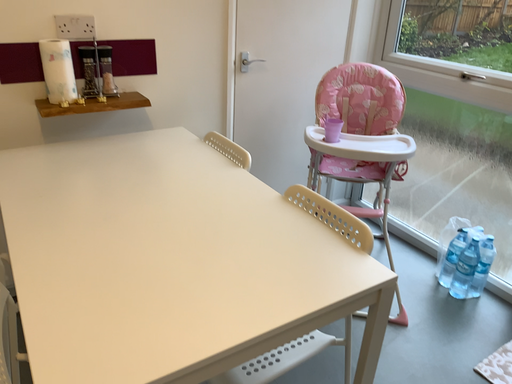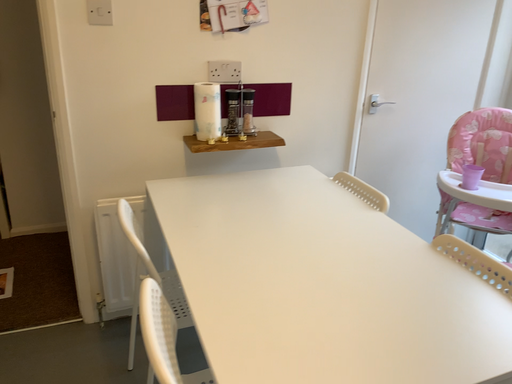
Question: Which way did the camera rotate in the video?

Choices:
 (A) rotated left
 (B) rotated right

Answer: (A)